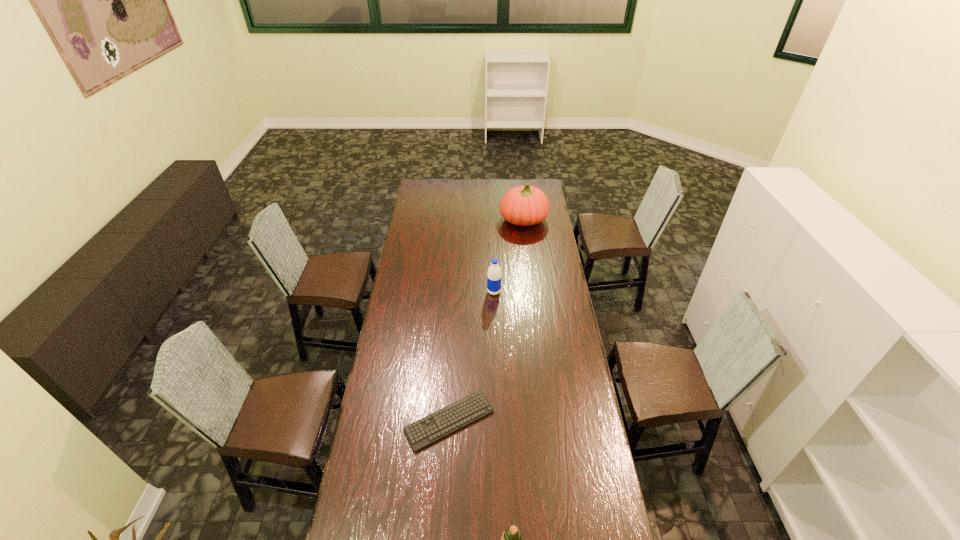
The image size is (960, 540). I want to click on the farthest object, so click(526, 205).

Where is `the tallest object`? This screenshot has width=960, height=540. the tallest object is located at coordinates (526, 205).

This screenshot has width=960, height=540. I want to click on water bottle, so click(x=494, y=272).

Where is `the third farthest object`? the third farthest object is located at coordinates (450, 419).

This screenshot has height=540, width=960. What are the coordinates of `computer keyboard` in the screenshot? It's located at (450, 419).

Find the location of `free space located on the left of the farthest object`. free space located on the left of the farthest object is located at coordinates pos(461,220).

What are the coordinates of `free spot located 0.280m on the front of the water bottle` in the screenshot? It's located at (495, 341).

Find the location of a particular element. This screenshot has width=960, height=540. free space located on the right of the third farthest object is located at coordinates (544, 421).

You are a GUI agent. You are given a task and a screenshot of the screen. Output one action in this format:
    pyautogui.click(x=<x>, y=<y>)
    Task: Click on the object that is at the left edge
    This screenshot has height=540, width=960.
    Given the screenshot: What is the action you would take?
    pyautogui.click(x=450, y=419)

Find the location of a particular element. object positioned at the right edge is located at coordinates (526, 205).